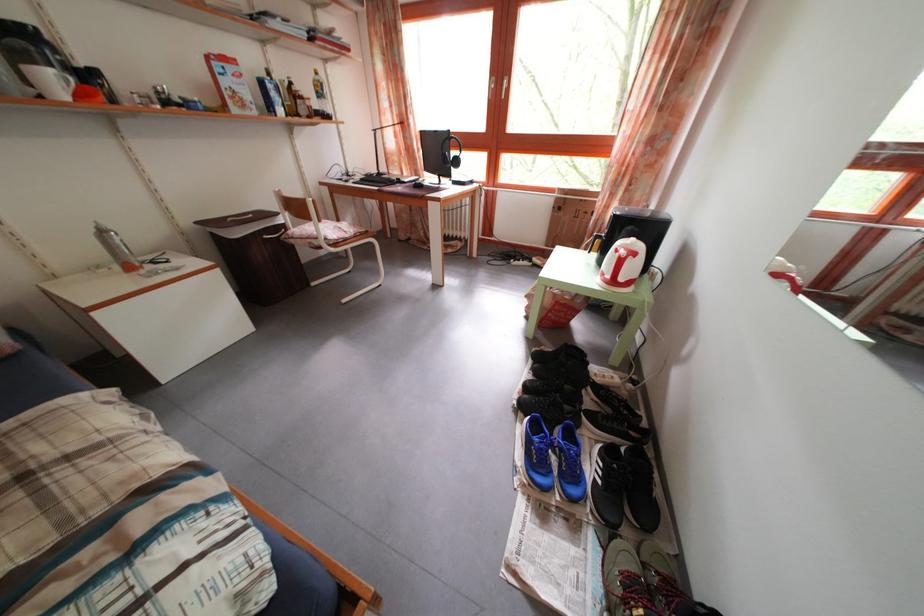
What do you see at coordinates (505, 86) in the screenshot? I see `a white window handle` at bounding box center [505, 86].